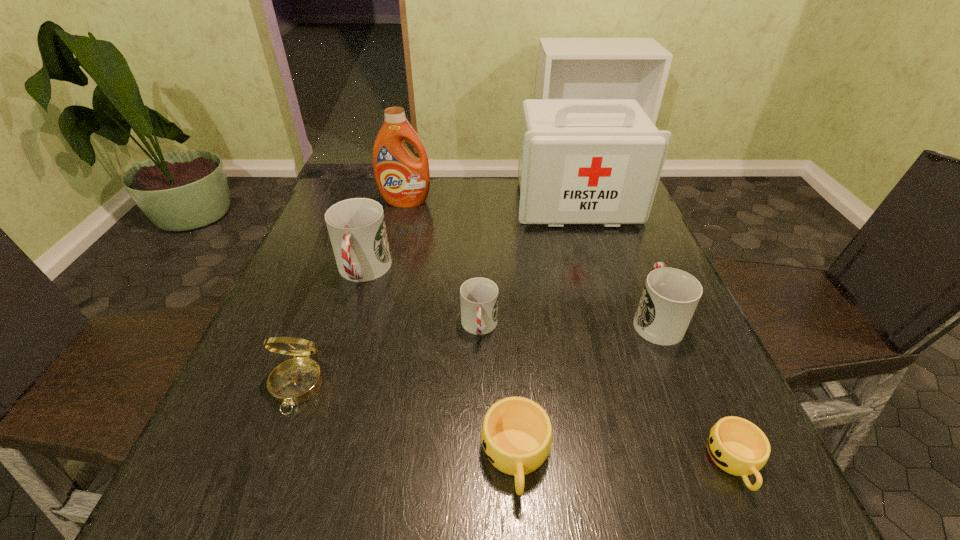
The image size is (960, 540). What are the coordinates of `the bigger beige cup` in the screenshot? It's located at (516, 435).

Find the location of a particular element. Image resolution: width=960 pixels, height=540 pixels. the smaller beige cup is located at coordinates (736, 445).

I want to click on the shortest object, so click(736, 445).

At what (x,y) coordinates should I click in order to perform the action: click on free space located 0.170m on the front-facing side of the first-aid kit. Please return your answer as a coordinate pair (x, y). The width and height of the screenshot is (960, 540). Looking at the image, I should click on (597, 271).

This screenshot has width=960, height=540. What are the coordinates of `free location located on the front-facing side of the detergent` in the screenshot? It's located at (402, 218).

At what (x,y) coordinates should I click in order to perform the action: click on vacant space located 0.350m on the side of the biggest red cup where the handle is located. Please return your answer as a coordinate pair (x, y). The width and height of the screenshot is (960, 540). Looking at the image, I should click on (308, 449).

The image size is (960, 540). What are the coordinates of `free spot located 0.280m on the side of the rightmost red cup where the handle is located` in the screenshot? It's located at (616, 224).

At what (x,y) coordinates should I click in order to perform the action: click on free space located on the side of the rightmost red cup where the handle is located. Please return your answer as a coordinate pair (x, y). The width and height of the screenshot is (960, 540). Looking at the image, I should click on (609, 205).

The image size is (960, 540). I want to click on vacant area situated on the side of the rightmost red cup where the handle is located, so click(634, 267).

The width and height of the screenshot is (960, 540). I want to click on vacant space located with the dial facing the sixth farthest object, so click(x=276, y=443).